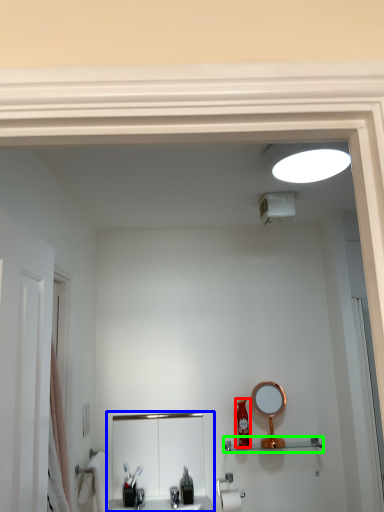
Question: Which is farther away from toiletry (highlighted by a red box)? sink (highlighted by a blue box) or shelve (highlighted by a green box)?

Choices:
 (A) sink
 (B) shelve

Answer: (A)